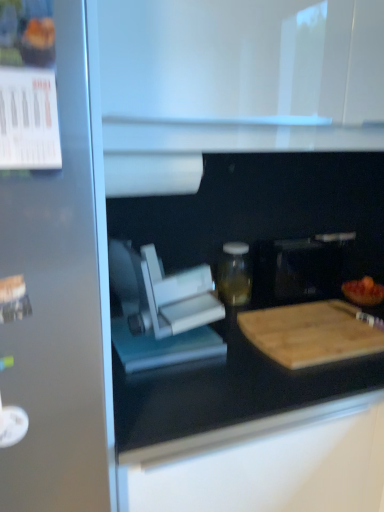
Question: From a real-world perspective, is transparent glass jar at center under wooden cutting board at lower right?

Choices:
 (A) no
 (B) yes

Answer: (A)

Question: Is transparent glass jar at center looking in the opposite direction of wooden cutting board at lower right?

Choices:
 (A) no
 (B) yes

Answer: (A)

Question: Is transparent glass jar at center placed right next to wooden cutting board at lower right?

Choices:
 (A) yes
 (B) no

Answer: (B)

Question: Can you confirm if transparent glass jar at center is wider than wooden cutting board at lower right?

Choices:
 (A) no
 (B) yes

Answer: (A)

Question: Does transparent glass jar at center have a smaller size compared to wooden cutting board at lower right?

Choices:
 (A) no
 (B) yes

Answer: (B)

Question: Considering the positions of wooden cutting board at right and white plastic food processor at center, which appears as the second appliance when viewed from the back, in the image, is wooden cutting board at right wider or thinner than white plastic food processor at center, which appears as the second appliance when viewed from the back,?

Choices:
 (A) wide
 (B) thin

Answer: (B)

Question: Considering the positions of wooden cutting board at right and white plastic food processor at center, the 1th appliance viewed from the left, in the image, is wooden cutting board at right taller or shorter than white plastic food processor at center, the 1th appliance viewed from the left,?

Choices:
 (A) short
 (B) tall

Answer: (A)

Question: Considering the positions of wooden cutting board at right and white plastic food processor at center, the 2th appliance when ordered from right to left, in the image, is wooden cutting board at right bigger or smaller than white plastic food processor at center, the 2th appliance when ordered from right to left,?

Choices:
 (A) big
 (B) small

Answer: (B)

Question: Is point (360, 305) closer or farther from the camera than point (153, 316)?

Choices:
 (A) farther
 (B) closer

Answer: (A)

Question: Looking at the image, does wooden cutting board at right seem bigger or smaller compared to transparent glass jar at center?

Choices:
 (A) small
 (B) big

Answer: (A)

Question: Considering the positions of wooden cutting board at right and transparent glass jar at center in the image, is wooden cutting board at right taller or shorter than transparent glass jar at center?

Choices:
 (A) short
 (B) tall

Answer: (A)

Question: Considering their positions, is wooden cutting board at right located in front of or behind transparent glass jar at center?

Choices:
 (A) behind
 (B) front

Answer: (A)

Question: From a real-world perspective, is wooden cutting board at right physically located above or below transparent glass jar at center?

Choices:
 (A) below
 (B) above

Answer: (A)

Question: Looking at their shapes, would you say white plastic food processor at center, the 2th appliance when ordered from right to left, is wider or thinner than wooden cutting board at lower right?

Choices:
 (A) wide
 (B) thin

Answer: (B)

Question: Is point (147, 263) positioned closer to the camera than point (317, 318)?

Choices:
 (A) farther
 (B) closer

Answer: (B)